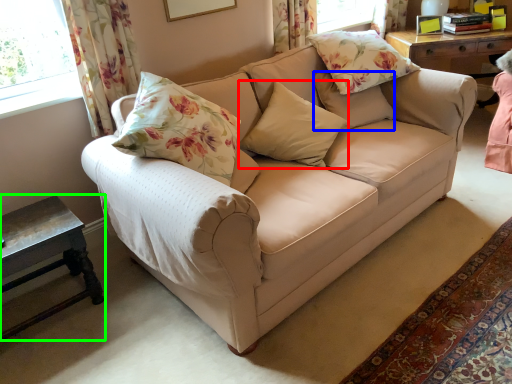
Question: Which object is positioned closest to pillow (highlighted by a red box)? Select from pillow (highlighted by a blue box) and table (highlighted by a green box).

Choices:
 (A) pillow
 (B) table

Answer: (A)